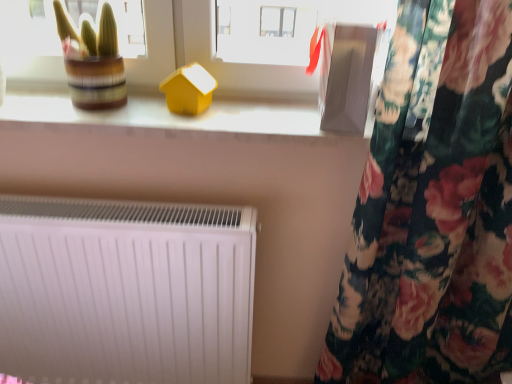
The height and width of the screenshot is (384, 512). Find the location of `free space to the left of green striped pot at upper left`. free space to the left of green striped pot at upper left is located at coordinates (41, 108).